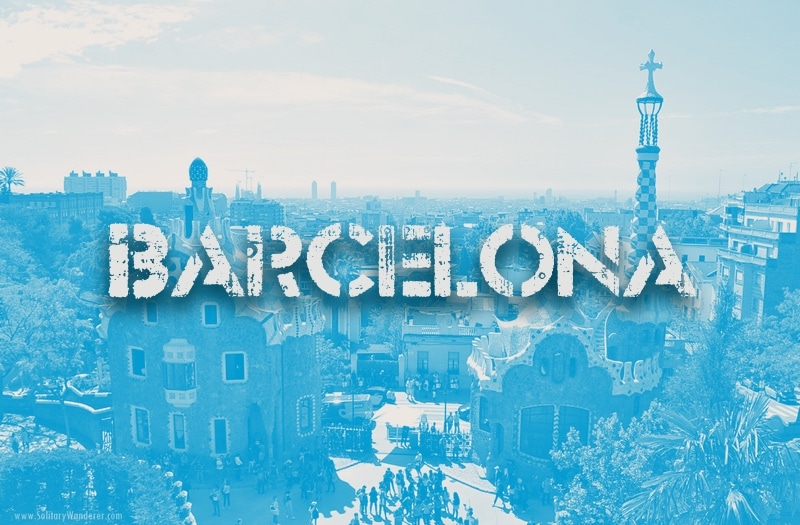
At what (x,y) coordinates should I click in order to perform the action: click on first floor windows. Please return your answer as a coordinate pair (x, y). Looking at the image, I should click on (149, 432), (170, 433), (214, 432).